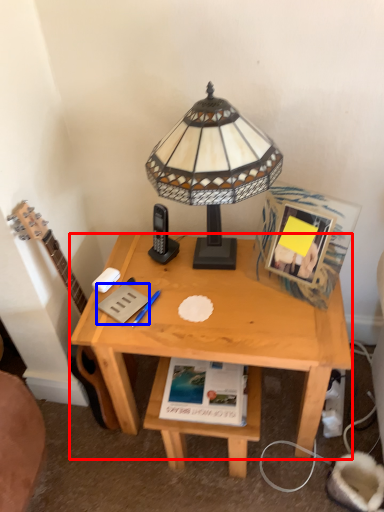
Question: Which object is closer to the camera taking this photo, desk (highlighted by a red box) or paperback book (highlighted by a blue box)?

Choices:
 (A) desk
 (B) paperback book

Answer: (A)